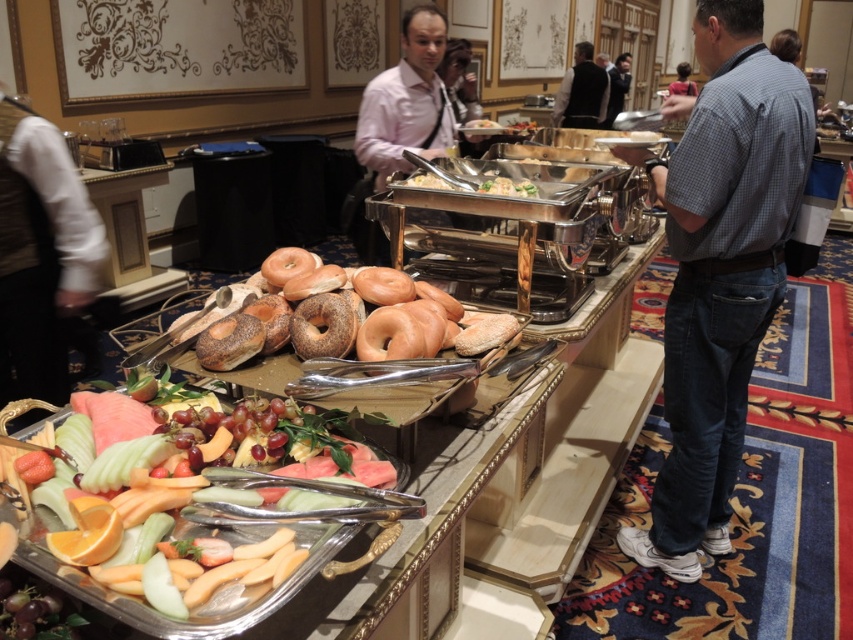
Is the position of brown matte bagel at center less distant than that of dark gray shirt at center?

Yes, it is.

Does brown matte bagel at center appear under dark gray shirt at center?

Indeed, brown matte bagel at center is positioned under dark gray shirt at center.

Identify the location of brown matte bagel at center. (372, 316).

Between brown matte bagel at center and pink shirt at center, which one appears on the right side from the viewer's perspective?

Positioned to the right is brown matte bagel at center.

Based on the photo, can you confirm if brown matte bagel at center is thinner than pink shirt at center?

Incorrect, brown matte bagel at center's width is not less than pink shirt at center's.

Is point (426, 336) positioned in front of point (399, 145)?

Yes, it is.

Find the location of a particular element. brown matte bagel at center is located at coordinates (372, 316).

Does point (695, 13) come farther from viewer compared to point (613, 81)?

That is False.

This screenshot has width=853, height=640. I want to click on denim jeans at center, so click(718, 269).